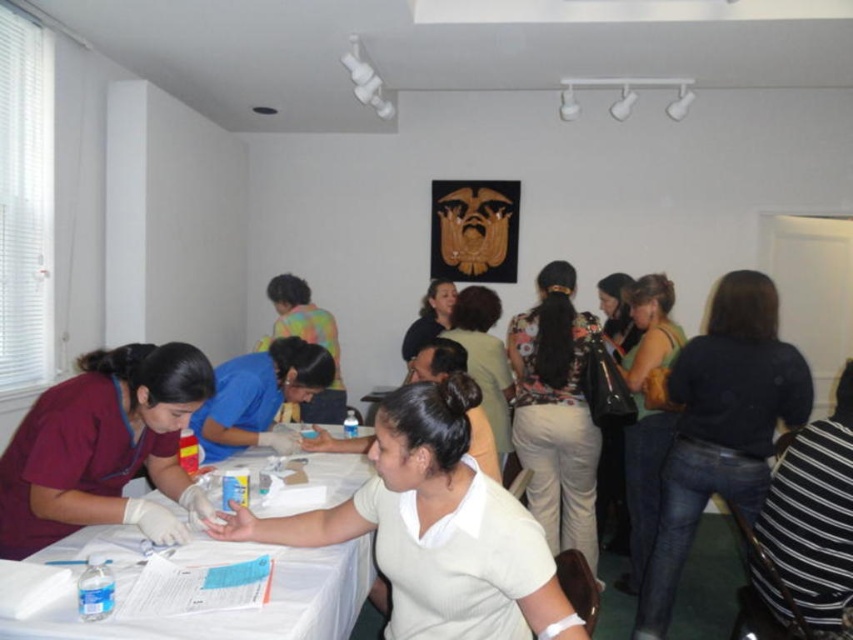
You are a photographer trying to capture a closeup of the person wearing the floral print blouse at center and the person wearing the matte green tank top at center. Which clothing item has a larger width when viewed from the front?

The floral print blouse at center might be wider than matte green tank top at center, so the floral print blouse at center has a larger width when viewed from the front.

You are organizing a blood donation event and need to place a large medical kit on the table. Given the sizes of the white paper table at center and the blue uniform shirt at center, will the medical kit fit on the table?

The white paper table at center has a larger size compared to the blue uniform shirt at center. Since the table is larger, the medical kit should fit on the white paper table at center.

You are a person who just arrived at the blood donation event and need to place a water bottle on the table. The water bottle is 15 inches tall. Is there enough space between the white paper table at center and blue uniform shirt at center to place it?

The white paper table at center is 16.95 inches from blue uniform shirt at center. Since the water bottle is 15 inches tall, there is enough space between them to place it.